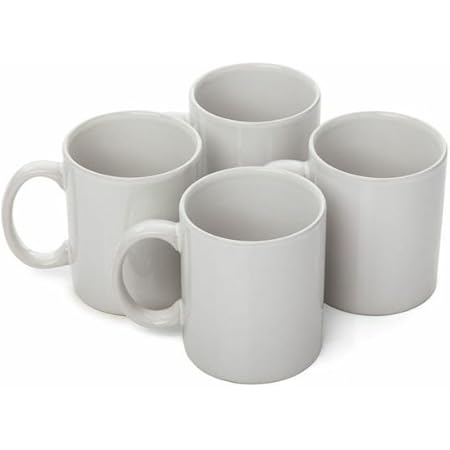
Locate an element on the screen. Image resolution: width=450 pixels, height=450 pixels. mug is located at coordinates (123, 216), (253, 285), (243, 141), (378, 207).